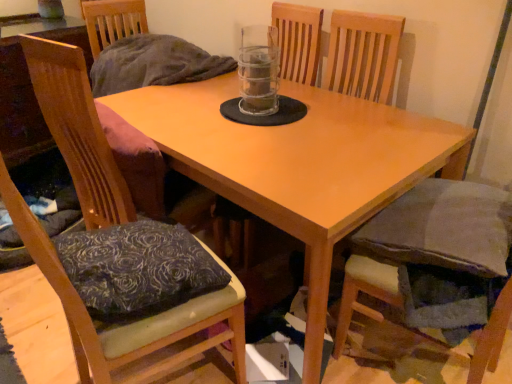
Question: Is light brown wooden table at center far from transparent plastic beverage at center?

Choices:
 (A) no
 (B) yes

Answer: (A)

Question: Is light brown wooden table at center behind transparent plastic beverage at center?

Choices:
 (A) no
 (B) yes

Answer: (A)

Question: Can you confirm if light brown wooden table at center is thinner than transparent plastic beverage at center?

Choices:
 (A) no
 (B) yes

Answer: (A)

Question: Does light brown wooden table at center have a larger size compared to transparent plastic beverage at center?

Choices:
 (A) yes
 (B) no

Answer: (A)

Question: Is light brown wooden table at center shorter than transparent plastic beverage at center?

Choices:
 (A) no
 (B) yes

Answer: (A)

Question: Is transparent plastic beverage at center a part of light brown wooden table at center?

Choices:
 (A) yes
 (B) no

Answer: (B)

Question: Is transparent plastic beverage at center closer to the viewer compared to satin dark blue pillow at lower left?

Choices:
 (A) no
 (B) yes

Answer: (A)

Question: Considering the relative positions of transparent plastic beverage at center and satin dark blue pillow at lower left in the image provided, is transparent plastic beverage at center to the left of satin dark blue pillow at lower left from the viewer's perspective?

Choices:
 (A) no
 (B) yes

Answer: (A)

Question: Considering the relative positions of transparent plastic beverage at center and satin dark blue pillow at lower left in the image provided, is transparent plastic beverage at center behind satin dark blue pillow at lower left?

Choices:
 (A) yes
 (B) no

Answer: (A)

Question: Is transparent plastic beverage at center at the right side of satin dark blue pillow at lower left?

Choices:
 (A) yes
 (B) no

Answer: (A)

Question: From a real-world perspective, is transparent plastic beverage at center on satin dark blue pillow at lower left?

Choices:
 (A) yes
 (B) no

Answer: (A)

Question: Considering the relative sizes of transparent plastic beverage at center and satin dark blue pillow at lower left in the image provided, is transparent plastic beverage at center shorter than satin dark blue pillow at lower left?

Choices:
 (A) yes
 (B) no

Answer: (B)

Question: Is transparent plastic beverage at center further to the viewer compared to wooden cushioned chair at left, which ranks as the second chair in right-to-left order?

Choices:
 (A) no
 (B) yes

Answer: (B)